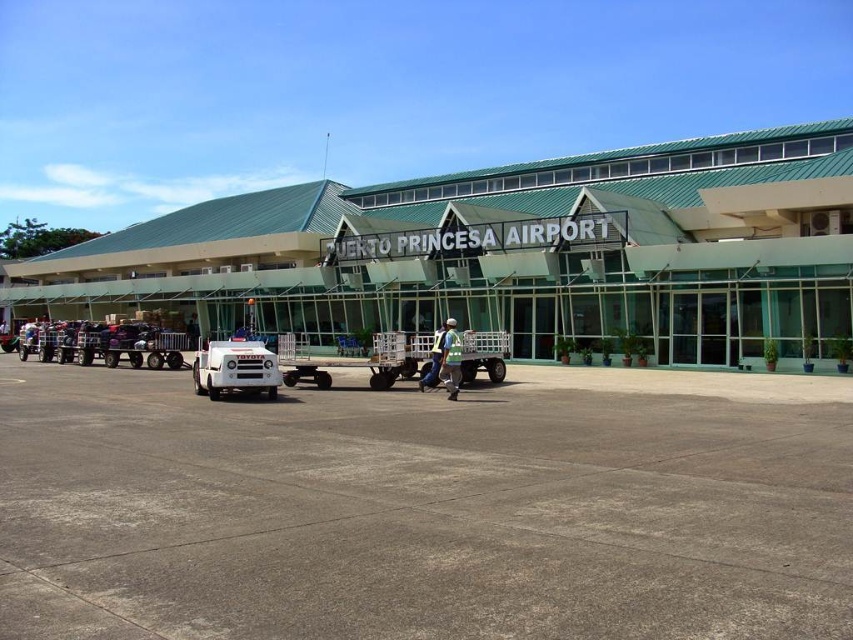
You are standing at the entrance of Puerto Princesa Airport and want to locate the point at coordinate (509, 252). According to the image, where exactly is this point located?

The point at coordinate (509, 252) is on the green glass building at center.

You are a delivery driver arriving at Puerto Princesa Airport. You need to park your vehicle between the green glass building at center and the white plastic cart at center. Is this possible given their positions?

The green glass building at center is to the left of the white plastic cart at center, so there is space between them where you can park your vehicle.

You are standing at the entrance of Puerto Princesa Airport and want to locate the white plastic cart at center. According to the image, what are the coordinates where you can find it?

The white plastic cart at center can be found at coordinates point [399,356].